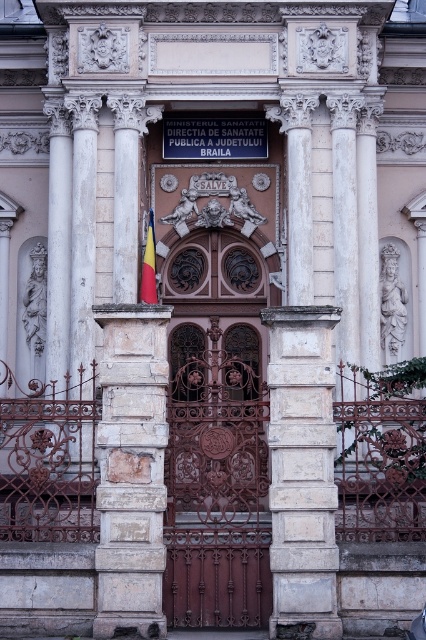
Question: Considering the real-world distances, which object is closest to the polished wood flag at center?

Choices:
 (A) white stone column at left
 (B) white stone column at center

Answer: (A)

Question: Which object is positioned closest to the white stone column at left?

Choices:
 (A) white stone column at center
 (B) polished wood flag at center

Answer: (A)

Question: Observing the image, what is the correct spatial positioning of white stone column at left in reference to white stone column at center?

Choices:
 (A) above
 (B) below

Answer: (A)

Question: Is white stone column at left to the left of polished wood flag at center from the viewer's perspective?

Choices:
 (A) yes
 (B) no

Answer: (A)

Question: Is white stone column at left wider than polished wood flag at center?

Choices:
 (A) yes
 (B) no

Answer: (A)

Question: Which of the following is the farthest from the observer?

Choices:
 (A) (152, 252)
 (B) (155, 563)

Answer: (A)